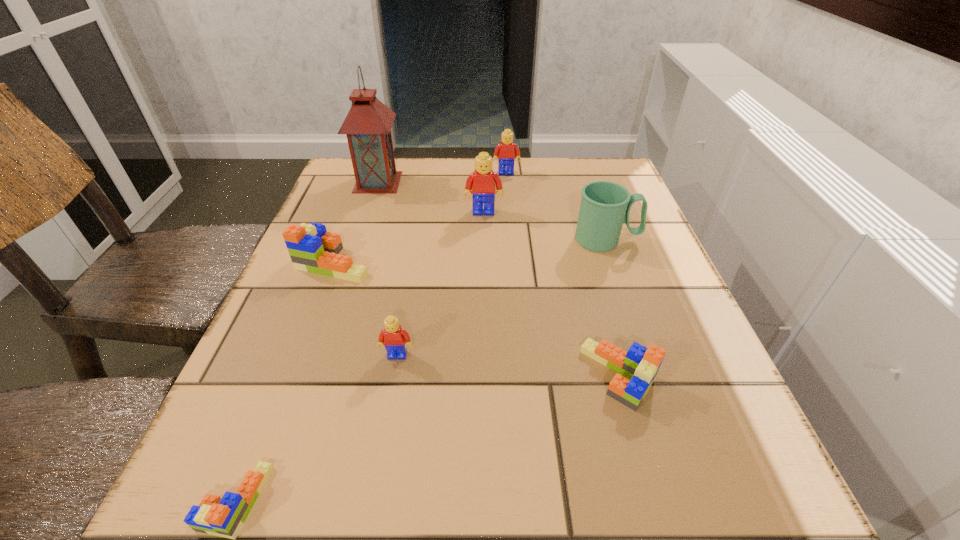
Find the location of `the nearest yellow Lego`. the nearest yellow Lego is located at coordinates (395, 339).

Where is `the second shortest Lego`? This screenshot has height=540, width=960. the second shortest Lego is located at coordinates (640, 364).

Identify the location of the second nearest orange Lego. (640, 364).

This screenshot has width=960, height=540. I want to click on the nearest orange Lego, so click(x=224, y=517).

This screenshot has height=540, width=960. In order to click on the shortest Lego in this screenshot , I will do `click(224, 517)`.

This screenshot has height=540, width=960. Identify the location of vacant area situated on the front of the tallest object. (366, 219).

Where is `free region located on the front-facing side of the second farthest Lego`? The height and width of the screenshot is (540, 960). free region located on the front-facing side of the second farthest Lego is located at coordinates (484, 254).

Where is `free location located on the front-facing side of the farthest yellow Lego`? This screenshot has height=540, width=960. free location located on the front-facing side of the farthest yellow Lego is located at coordinates (515, 268).

This screenshot has height=540, width=960. What are the coordinates of `vacant space located on the right of the third farthest Lego` in the screenshot? It's located at (410, 262).

Where is `free space located on the front-facing side of the leftmost yellow Lego`? The width and height of the screenshot is (960, 540). free space located on the front-facing side of the leftmost yellow Lego is located at coordinates (385, 428).